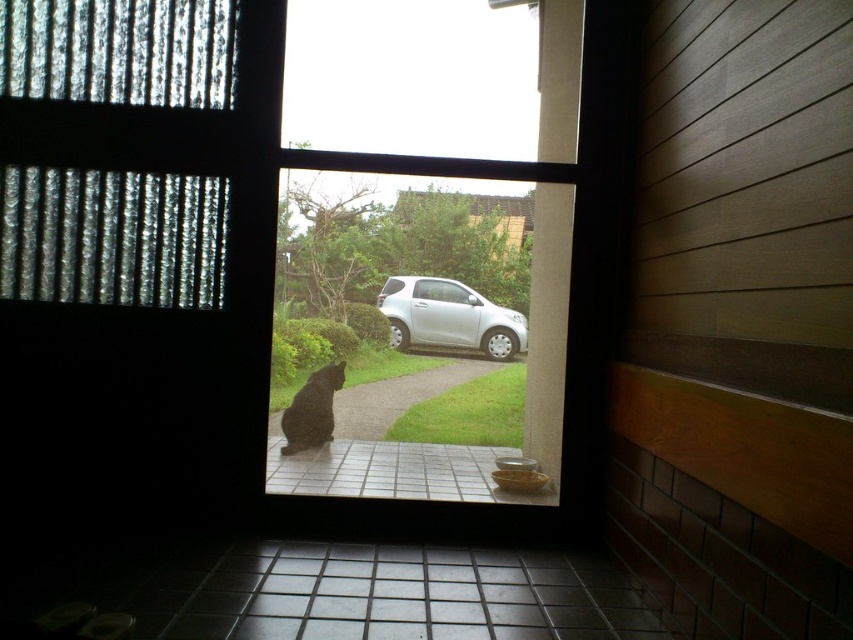
You are standing in front of the door and want to check if the transparent glass window at center is positioned in the middle of the door. Based on the coordinates provided, can you confirm if it is centered?

The transparent glass window at center is located at point coordinates, so it is centered on the door.

You are standing inside the house looking through the partially open wooden door. You see the translucent plastic curtain at upper left and the black fur cat at center. Which object is higher up in your field of view?

The translucent plastic curtain at upper left is above the black fur cat at center, so it is higher up in your field of view.

You are trying to decide whether to hang a decorative wreath on the translucent plastic curtain at upper left or the black fur cat at center. Based on their sizes, which object would be more suitable for the wreath?

The translucent plastic curtain at upper left has a smaller size compared to the black fur cat at center, so the wreath would be more suitable for the translucent plastic curtain at upper left since it is smaller and likely more appropriate for hanging decorations.